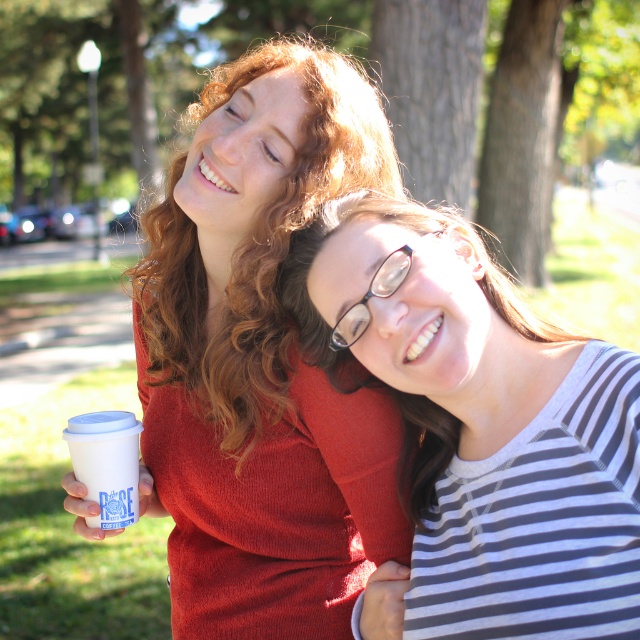
Question: Which object is the farthest from the white paper cup at left?

Choices:
 (A) matte red sweater at upper center
 (B) green leafy tree at upper center
 (C) striped fabric shirt at center

Answer: (B)

Question: Among these points, which one is nearest to the camera?

Choices:
 (A) (289, 564)
 (B) (116, 524)
 (C) (579, 580)
 (D) (616, 122)

Answer: (C)

Question: Can you confirm if matte red sweater at upper center is positioned to the right of green textured bark at upper center?

Choices:
 (A) no
 (B) yes

Answer: (A)

Question: Can you confirm if striped fabric shirt at center is positioned below green leafy tree at upper center?

Choices:
 (A) yes
 (B) no

Answer: (A)

Question: Among these objects, which one is nearest to the camera?

Choices:
 (A) green leafy tree at upper center
 (B) matte red sweater at upper center
 (C) white paper cup at left

Answer: (C)

Question: From the image, what is the correct spatial relationship of matte red sweater at upper center in relation to green leafy tree at upper center?

Choices:
 (A) above
 (B) below

Answer: (B)